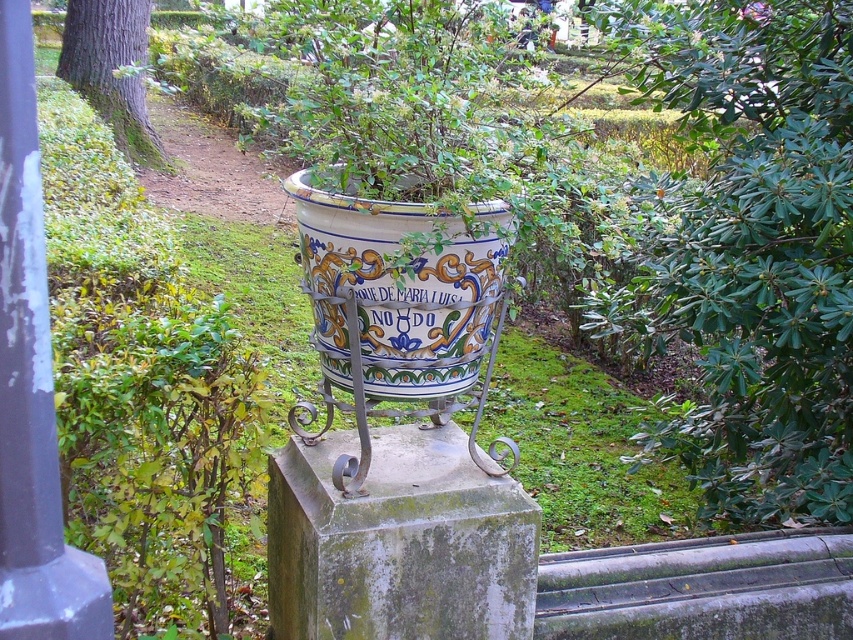
Which of these two, green leafy bush at upper right or smooth gray pole at left, stands taller?

With more height is green leafy bush at upper right.

Measure the distance between green leafy bush at upper right and camera.

green leafy bush at upper right is 2.69 meters from camera.

Locate an element on the screen. The height and width of the screenshot is (640, 853). green leafy bush at upper right is located at coordinates (758, 250).

In order to click on smooth gray pole at left in this screenshot , I will do `click(32, 385)`.

Is point (3, 227) closer to camera compared to point (141, 76)?

Yes.

Between point (10, 310) and point (105, 45), which one is positioned in front?

Point (10, 310) is more forward.

The image size is (853, 640). Identify the location of smooth gray pole at left. (32, 385).

Does green leafy bush at upper right have a greater height compared to brown rough bark at upper left?

Yes, green leafy bush at upper right is taller than brown rough bark at upper left.

Which of these two, green leafy bush at upper right or brown rough bark at upper left, stands shorter?

brown rough bark at upper left is shorter.

What do you see at coordinates (758, 250) in the screenshot? I see `green leafy bush at upper right` at bounding box center [758, 250].

The width and height of the screenshot is (853, 640). Find the location of `green leafy bush at upper right`. green leafy bush at upper right is located at coordinates (758, 250).